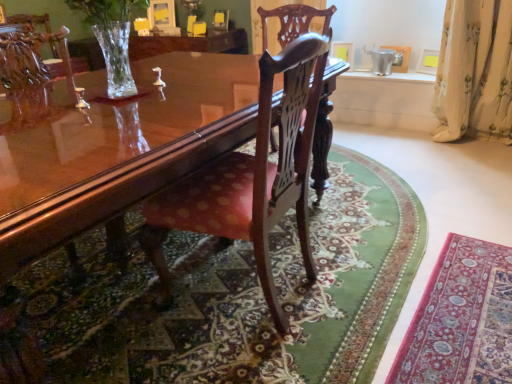
Question: Can you confirm if polished wood chair at center, the 2th chair from the back, is smaller than glossy wood coffee table at center?

Choices:
 (A) no
 (B) yes

Answer: (B)

Question: Is polished wood chair at center, the 1th chair from the front, bigger than glossy wood coffee table at center?

Choices:
 (A) no
 (B) yes

Answer: (A)

Question: Is the depth of polished wood chair at center, the 2th chair from the back, greater than that of glossy wood coffee table at center?

Choices:
 (A) no
 (B) yes

Answer: (B)

Question: Is polished wood chair at center, the 2th chair from the back, facing away from glossy wood coffee table at center?

Choices:
 (A) no
 (B) yes

Answer: (B)

Question: Is polished wood chair at center, the 1th chair from the front, far away from glossy wood coffee table at center?

Choices:
 (A) no
 (B) yes

Answer: (A)

Question: Visually, is polished wood chair at center, acting as the first chair starting from the back, positioned to the left or to the right of white floral fabric curtain at right?

Choices:
 (A) right
 (B) left

Answer: (B)

Question: Relative to white floral fabric curtain at right, is polished wood chair at center, the 2th chair in the front-to-back sequence, in front or behind?

Choices:
 (A) behind
 (B) front

Answer: (B)

Question: Looking at the image, does polished wood chair at center, acting as the first chair starting from the back, seem bigger or smaller compared to white floral fabric curtain at right?

Choices:
 (A) small
 (B) big

Answer: (B)

Question: Looking at their shapes, would you say polished wood chair at center, acting as the first chair starting from the back, is wider or thinner than white floral fabric curtain at right?

Choices:
 (A) thin
 (B) wide

Answer: (B)

Question: From a real-world perspective, is glossy wood coffee table at center positioned above or below polished wood chair at center, the 2th chair in the front-to-back sequence?

Choices:
 (A) above
 (B) below

Answer: (B)

Question: Considering the positions of point [x=70, y=223] and point [x=283, y=31], is point [x=70, y=223] closer or farther from the camera than point [x=283, y=31]?

Choices:
 (A) farther
 (B) closer

Answer: (B)

Question: Considering the positions of glossy wood coffee table at center and polished wood chair at center, acting as the first chair starting from the back, in the image, is glossy wood coffee table at center taller or shorter than polished wood chair at center, acting as the first chair starting from the back,?

Choices:
 (A) tall
 (B) short

Answer: (B)

Question: Is glossy wood coffee table at center bigger or smaller than polished wood chair at center, the 2th chair in the front-to-back sequence?

Choices:
 (A) small
 (B) big

Answer: (B)

Question: Considering the relative positions of polished wood chair at center, the 2th chair in the front-to-back sequence, and polished wood chair at center, the 2th chair from the back, in the image provided, is polished wood chair at center, the 2th chair in the front-to-back sequence, to the left or to the right of polished wood chair at center, the 2th chair from the back,?

Choices:
 (A) right
 (B) left

Answer: (A)

Question: From the image's perspective, is polished wood chair at center, acting as the first chair starting from the back, positioned above or below polished wood chair at center, the 2th chair from the back?

Choices:
 (A) below
 (B) above

Answer: (B)